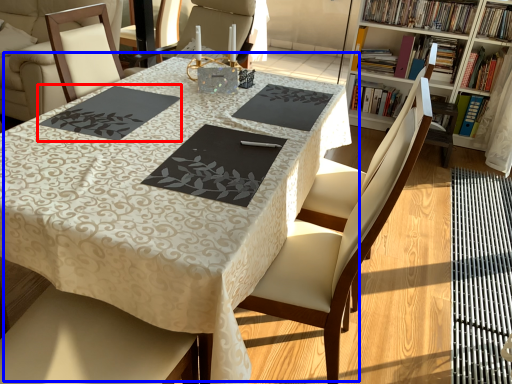
Question: Which point is closer to the camera, place mat (highlighted by a red box) or table (highlighted by a blue box)?

Choices:
 (A) place mat
 (B) table

Answer: (B)